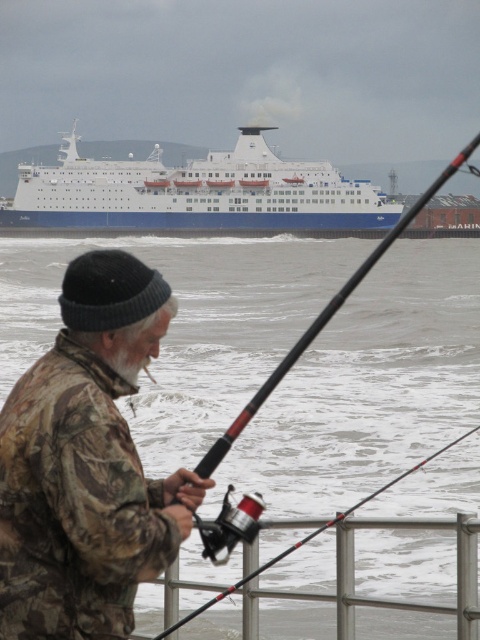
Is point (361, 563) less distant than point (223, 186)?

Yes, it is.

Is white frothy water at lower center in front of white matte ship at upper center?

Yes, it is.

The width and height of the screenshot is (480, 640). Describe the element at coordinates (369, 387) in the screenshot. I see `white frothy water at lower center` at that location.

What are the coordinates of `white frothy water at lower center` in the screenshot? It's located at (369, 387).

Can you confirm if white matte ship at upper center is positioned to the left of camouflage fabric fishing pole at center?

Indeed, white matte ship at upper center is positioned on the left side of camouflage fabric fishing pole at center.

Measure the distance from white matte ship at upper center to camouflage fabric fishing pole at center.

white matte ship at upper center and camouflage fabric fishing pole at center are 126.35 meters apart from each other.

The width and height of the screenshot is (480, 640). What are the coordinates of `white matte ship at upper center` in the screenshot? It's located at (194, 193).

Which of these two, camouflage fabric jacket at left or white matte ship at upper center, stands taller?

white matte ship at upper center is taller.

Between camouflage fabric jacket at left and white matte ship at upper center, which one appears on the left side from the viewer's perspective?

white matte ship at upper center is more to the left.

Is point (118, 272) more distant than point (187, 204)?

That is False.

Where is `camouflage fabric jacket at left`? camouflage fabric jacket at left is located at coordinates (86, 464).